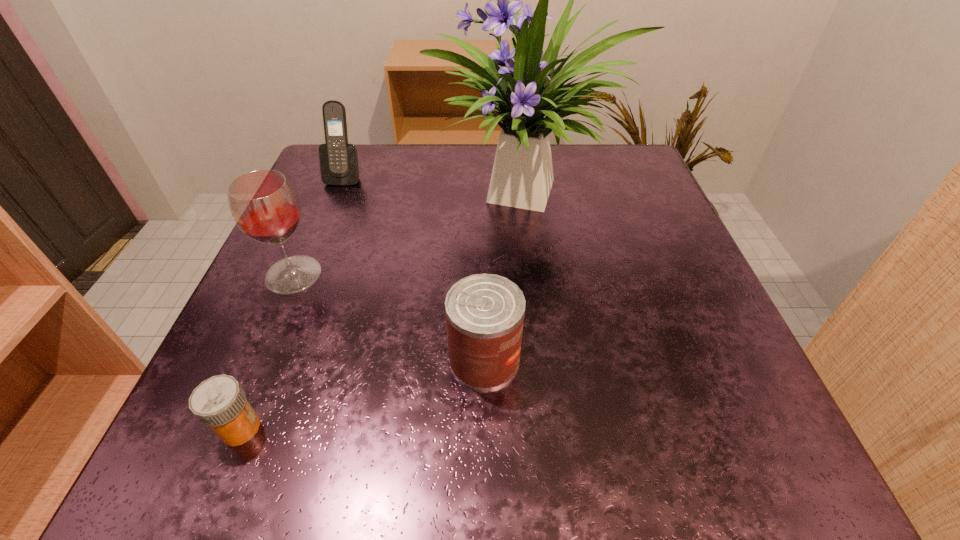
This screenshot has width=960, height=540. Find the location of `flower arrangement`. flower arrangement is located at coordinates (525, 88).

In order to click on wineglass in this screenshot , I will do `click(265, 207)`.

The width and height of the screenshot is (960, 540). What are the coordinates of `cellular telephone` in the screenshot? It's located at (339, 166).

The height and width of the screenshot is (540, 960). I want to click on the fourth tallest object, so click(485, 313).

At what (x,y) coordinates should I click in order to perform the action: click on the fourth farthest object. Please return your answer as a coordinate pair (x, y). This screenshot has height=540, width=960. Looking at the image, I should click on (485, 313).

I want to click on medicine, so click(x=219, y=402).

You are a GUI agent. You are given a task and a screenshot of the screen. Output one action in this format:
    pyautogui.click(x=<x>, y=<y>)
    Task: Click on the shortest object
    This screenshot has width=960, height=540.
    Given the screenshot: What is the action you would take?
    pyautogui.click(x=219, y=402)

The image size is (960, 540). I want to click on vacant space located 0.120m on the left of the tallest object, so click(x=375, y=191).

You are a GUI agent. You are given a task and a screenshot of the screen. Output one action in this format:
    pyautogui.click(x=<x>, y=<y>)
    Task: Click on the vacant space located on the front of the wineglass
    Image resolution: width=960 pixels, height=540 pixels.
    Given the screenshot: What is the action you would take?
    pyautogui.click(x=269, y=334)

This screenshot has width=960, height=540. I want to click on free region located 0.340m on the front-facing side of the cellular telephone, so 294,305.